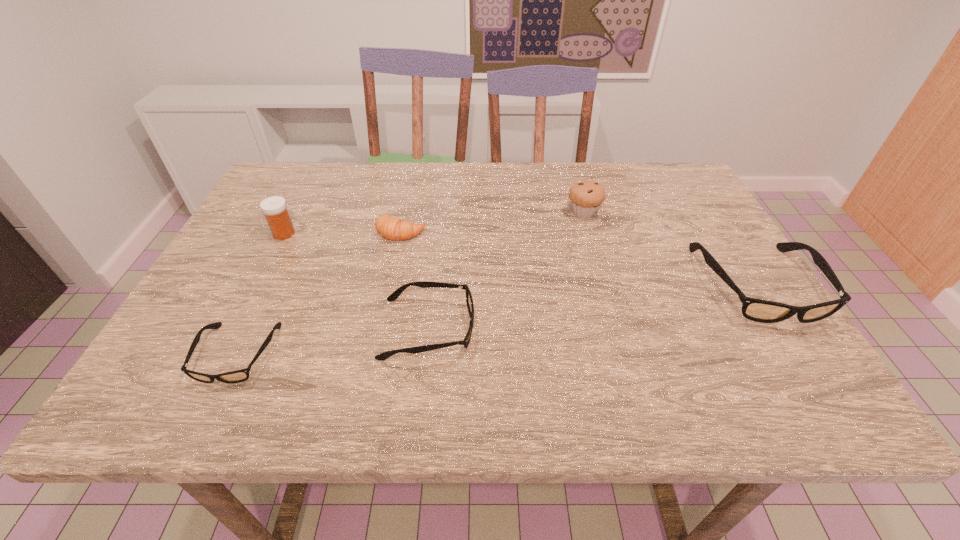
You are a GUI agent. You are given a task and a screenshot of the screen. Output one action in this format:
    pyautogui.click(x=<x>, y=<y>)
    Task: Click on the blank space at the right edge of the desktop
    This screenshot has width=960, height=540.
    Given the screenshot: What is the action you would take?
    pyautogui.click(x=705, y=278)

In the image, there is a desktop. At what (x,y) coordinates should I click in order to perform the action: click on vacant space at the far left corner. Please return your answer as a coordinate pair (x, y). The image size is (960, 540). Looking at the image, I should click on (321, 170).

This screenshot has width=960, height=540. In the image, there is a desktop. Find the location of `vacant region at the near left corner`. vacant region at the near left corner is located at coordinates (171, 340).

What are the coordinates of `free space between the second spectacles from right to left and the crescent roll` in the screenshot? It's located at (415, 280).

Identify the location of empty space that is in between the fifth object from left to right and the medicine. The width and height of the screenshot is (960, 540). (434, 223).

This screenshot has height=540, width=960. In order to click on free spot between the rightmost spectacles and the medicine in this screenshot , I will do `click(520, 259)`.

Find the location of `empty space that is in between the second spectacles from right to left and the crescent roll`. empty space that is in between the second spectacles from right to left and the crescent roll is located at coordinates (415, 280).

You are a GUI agent. You are given a task and a screenshot of the screen. Output one action in this format:
    pyautogui.click(x=<x>, y=<y>)
    Task: Click on the vacant point located between the crescent roll and the medicine
    This screenshot has height=540, width=960.
    Given the screenshot: What is the action you would take?
    pos(343,232)

The width and height of the screenshot is (960, 540). What are the coordinates of `vacant space that's between the crescent roll and the third tallest object` in the screenshot? It's located at (579, 258).

In order to click on vacant point located between the third tallest object and the second spectacles from left to right in this screenshot , I will do `click(592, 307)`.